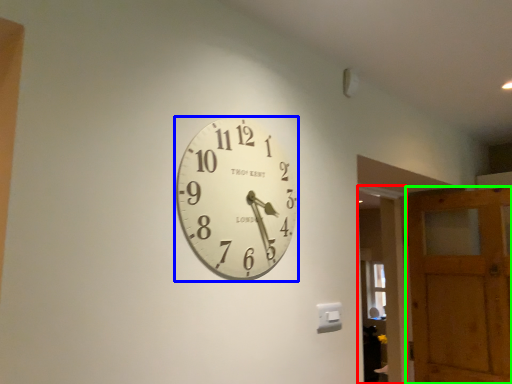
Question: Considering the real-world distances, which object is farthest from glass door (highlighted by a red box)? wall clock (highlighted by a blue box) or barn door (highlighted by a green box)?

Choices:
 (A) wall clock
 (B) barn door

Answer: (A)